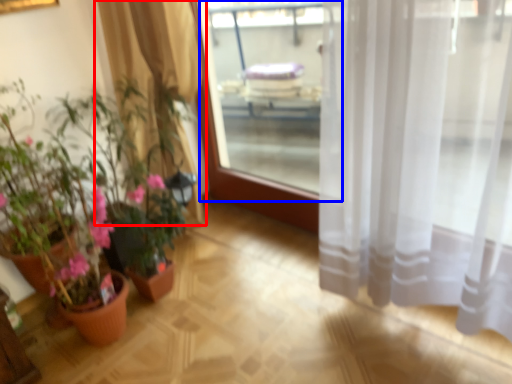
Question: Among these objects, which one is nearest to the camera, curtain (highlighted by a red box) or window screen (highlighted by a blue box)?

Choices:
 (A) curtain
 (B) window screen

Answer: (A)